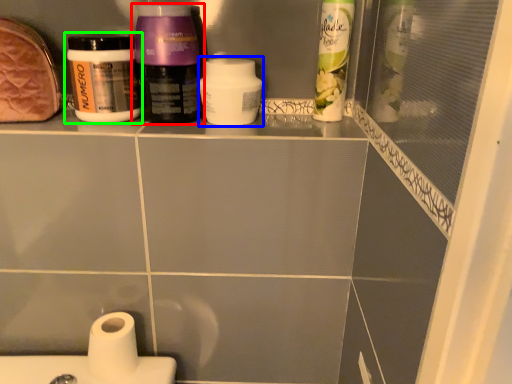
Question: Which object is the closest to the bottle (highlighted by a red box)? Choose among these: cleaning product (highlighted by a blue box) or bottle (highlighted by a green box).

Choices:
 (A) cleaning product
 (B) bottle

Answer: (B)